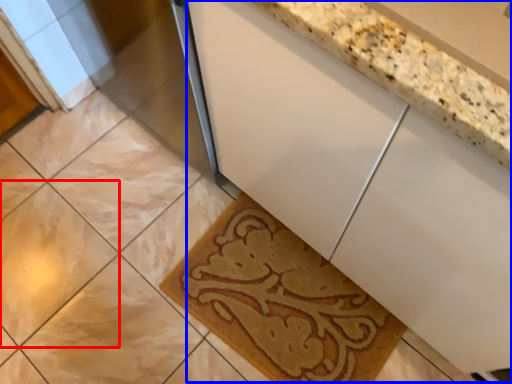
Question: Which object appears closest to the camera in this image, ceramic tile (highlighted by a red box) or counter (highlighted by a blue box)?

Choices:
 (A) ceramic tile
 (B) counter

Answer: (B)